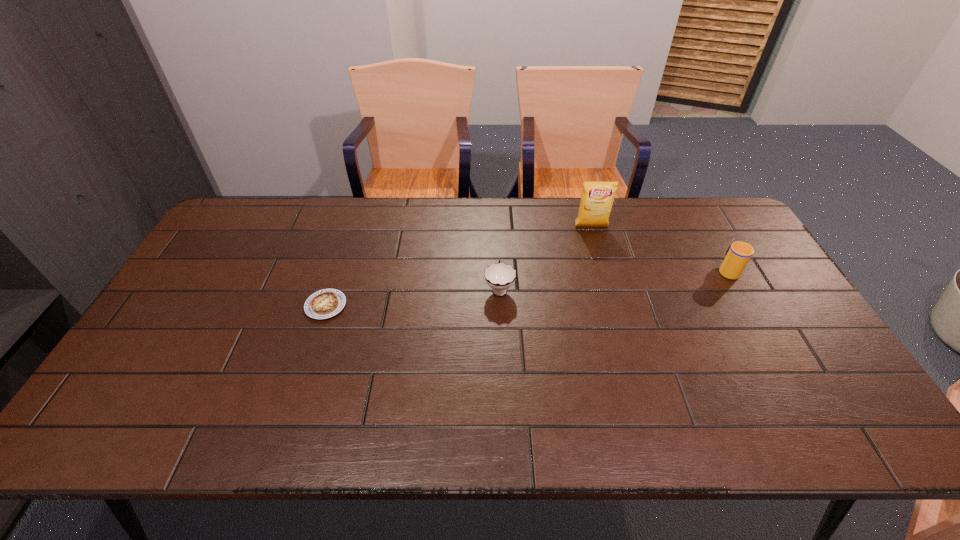
Find the location of a particular element. blank region between the quiche and the shorter cup is located at coordinates (413, 297).

Image resolution: width=960 pixels, height=540 pixels. I want to click on free point between the shortest object and the farthest object, so click(459, 266).

I want to click on empty space that is in between the third shortest object and the left cup, so click(x=613, y=279).

This screenshot has height=540, width=960. What are the coordinates of `free area in between the second object from right to left and the leftmost object` in the screenshot? It's located at click(x=459, y=266).

At what (x,y) coordinates should I click in order to perform the action: click on object that ranks as the closest to the third object from left to right. Please return your answer as a coordinate pair (x, y). Looking at the image, I should click on (500, 276).

Image resolution: width=960 pixels, height=540 pixels. Identify the location of the third closest object to the farthest object. (325, 303).